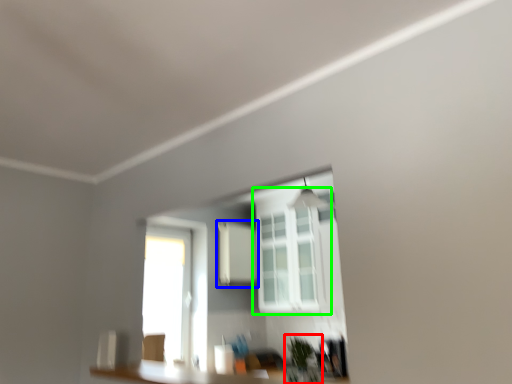
Question: Based on their relative distances, which object is farther from plant (highlighted by a red box)? Choose from medicine cabinet (highlighted by a blue box) and window (highlighted by a green box).

Choices:
 (A) medicine cabinet
 (B) window

Answer: (A)